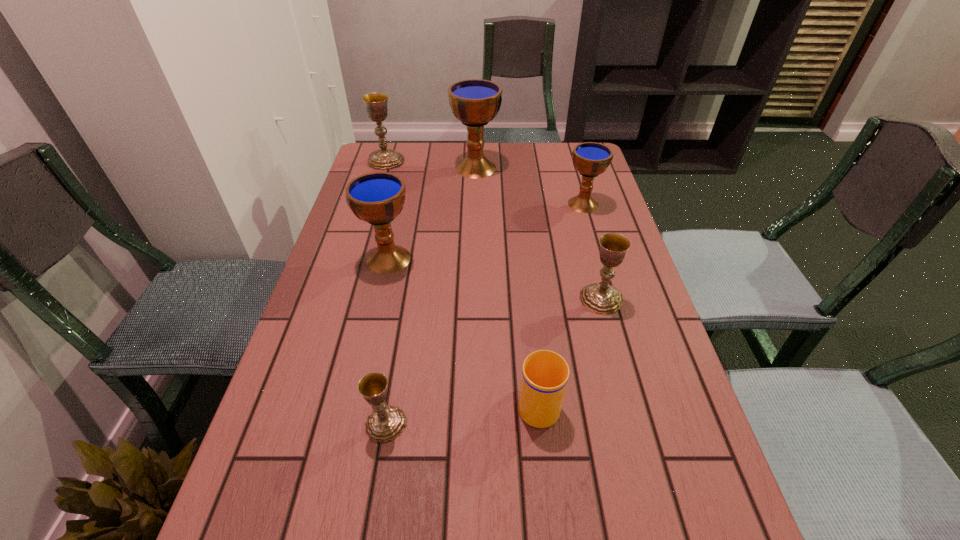
Identify the location of beige cup. (545, 374).

The height and width of the screenshot is (540, 960). What are the coordinates of `cup` in the screenshot? It's located at (545, 374).

Locate an element on the screen. The width and height of the screenshot is (960, 540). the nearest chalice is located at coordinates (385, 423).

You are a GUI agent. You are given a task and a screenshot of the screen. Output one action in this format:
    pyautogui.click(x=<x>, y=<y>)
    Task: Click on the second gold chalice from right to left
    This screenshot has height=540, width=960.
    Given the screenshot: What is the action you would take?
    pyautogui.click(x=385, y=423)

Identify the location of vacant region located 0.210m on the left of the third chalice from right to left. tap(391, 167).

Where is `free space located 0.340m on the right of the biggest gold chalice`? Image resolution: width=960 pixels, height=540 pixels. free space located 0.340m on the right of the biggest gold chalice is located at coordinates (x=501, y=160).

You are a GUI agent. You are given a task and a screenshot of the screen. Output one action in this format:
    pyautogui.click(x=<x>, y=<y>)
    Task: Click on the vacant space located 0.130m on the back of the fourth farthest chalice
    The width and height of the screenshot is (960, 540).
    Given the screenshot: What is the action you would take?
    pyautogui.click(x=398, y=215)

Where is `free spot located 0.060m on the left of the rightmost gold chalice`? free spot located 0.060m on the left of the rightmost gold chalice is located at coordinates (556, 299).

This screenshot has width=960, height=540. I want to click on vacant space situated on the front of the third farthest object, so click(x=612, y=303).

You are a GUI agent. You are given a task and a screenshot of the screen. Output one action in this format:
    pyautogui.click(x=<x>, y=<y>)
    Task: Click on the blank space located 0.130m on the side of the beige cup with the handle
    The image size is (960, 540).
    Given the screenshot: What is the action you would take?
    pyautogui.click(x=530, y=328)